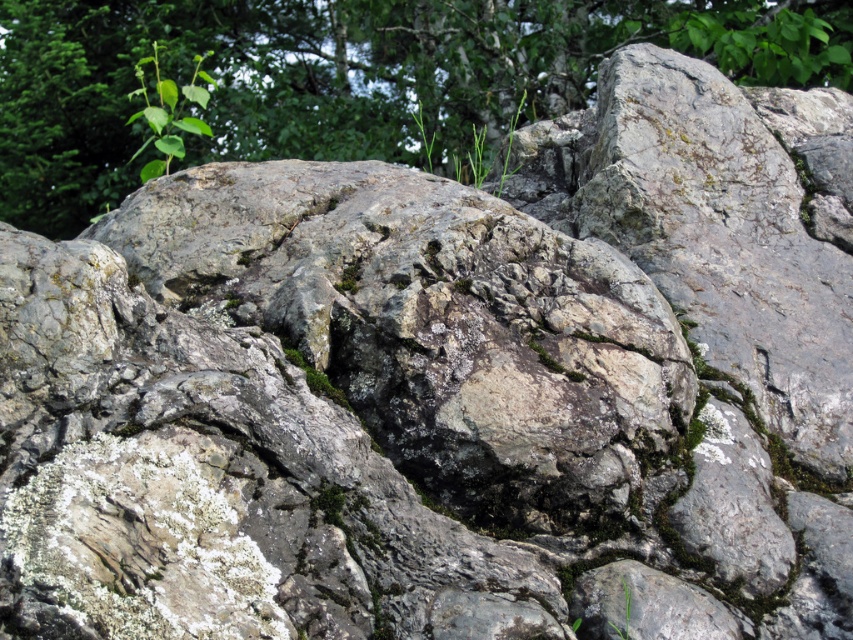
Question: Where is green leafy tree at upper center located in relation to green grass at upper center in the image?

Choices:
 (A) above
 (B) below

Answer: (A)

Question: Estimate the real-world distances between objects in this image. Which object is closer to the green leafy plant at upper left?

Choices:
 (A) green grass at upper center
 (B) green leafy tree at upper center

Answer: (B)

Question: Which object is closer to the camera taking this photo?

Choices:
 (A) green leafy tree at upper center
 (B) green grass at upper center

Answer: (B)

Question: Is green leafy tree at upper center wider than green grass at upper center?

Choices:
 (A) yes
 (B) no

Answer: (A)

Question: Which of the following is the closest to the observer?

Choices:
 (A) green leafy plant at upper left
 (B) green leafy tree at upper center
 (C) green grass at upper center

Answer: (C)

Question: Is green leafy tree at upper center above green leafy plant at upper left?

Choices:
 (A) yes
 (B) no

Answer: (A)